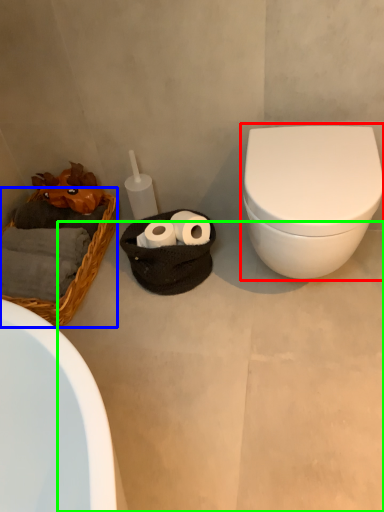
Question: Which object is positioned closest to toilet (highlighted by a red box)? Select from basket (highlighted by a blue box) and concrete (highlighted by a green box).

Choices:
 (A) basket
 (B) concrete

Answer: (B)